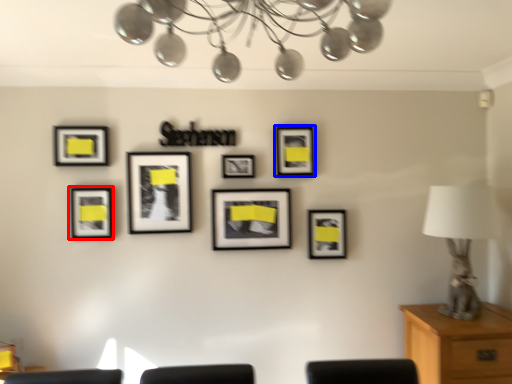
Question: Which object appears farthest to the camera in this image, picture frame (highlighted by a red box) or picture frame (highlighted by a blue box)?

Choices:
 (A) picture frame
 (B) picture frame

Answer: (B)